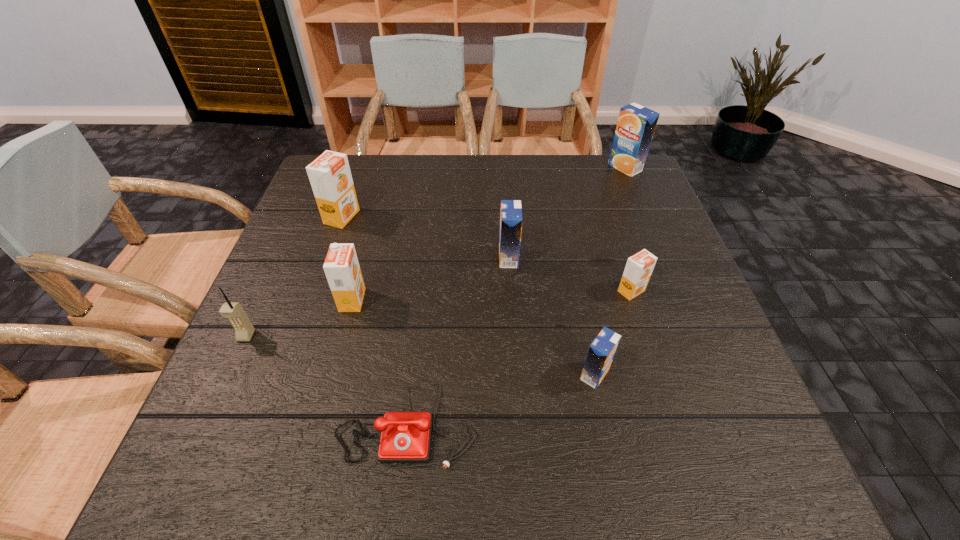
Locate an element on the screen. This screenshot has width=960, height=540. blue orange_juice that is the closest to the second farthest blue orange_juice is located at coordinates (601, 352).

The image size is (960, 540). I want to click on orange orange juice that is the closest one to the telephone, so click(341, 266).

Identify which orange orange juice is located as the second nearest to the second farthest orange juice. Please provide its 2D coordinates. Your answer should be formatted as a tuple, i.e. [(x, y)], where the tuple contains the x and y coordinates of a point satisfying the conditions above.

[(639, 267)]

Locate an element on the screen. This screenshot has width=960, height=540. blank space that satisfies the following two spatial constraints: 1. on the back side of the farthest blue orange_juice; 2. on the right side of the second biggest orange orange juice is located at coordinates (388, 167).

The height and width of the screenshot is (540, 960). What are the coordinates of `vacant point that satisfies the following two spatial constraints: 1. on the back side of the fifth orange juice from right to left; 2. on the left side of the rightmost blue orange_juice` in the screenshot? It's located at (388, 167).

The height and width of the screenshot is (540, 960). Identify the location of vacant region that satisfies the following two spatial constraints: 1. on the back side of the nearest orange juice; 2. on the right side of the second orange juice from right to left. (577, 291).